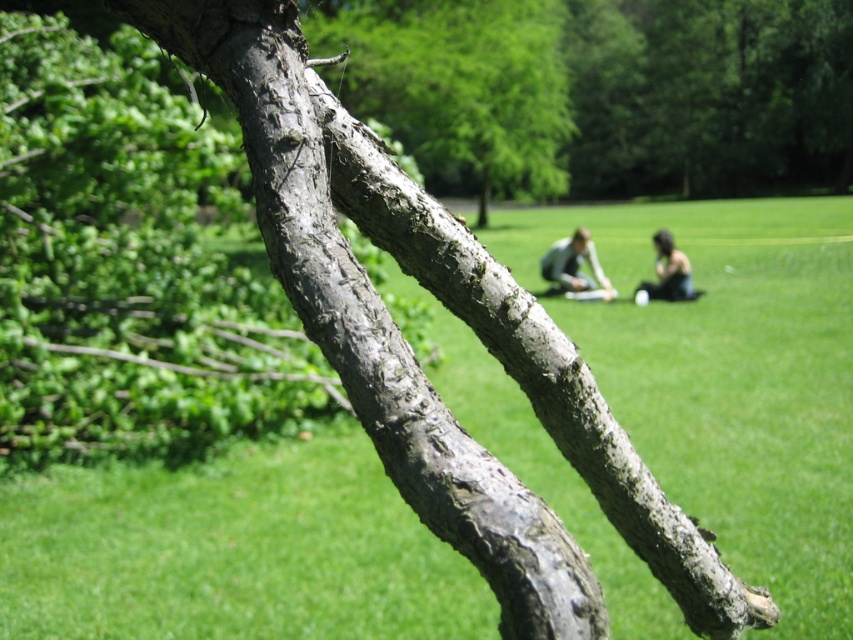
Which of these two, gray rough bark branch at upper center or light brown fabric at lower center, stands taller?

gray rough bark branch at upper center

Looking at this image, measure the distance between point (x=558, y=140) and camera.

Point (x=558, y=140) is 62.99 feet away from camera.

Does point (486, 16) lie in front of point (593, 260)?

No, (486, 16) is further to viewer.

Where is `gray rough bark branch at upper center`? gray rough bark branch at upper center is located at coordinates (457, 86).

Between gray rough bark tree trunk at center and light brown fabric at lower center, which one is positioned lower?

gray rough bark tree trunk at center is lower down.

Is gray rough bark tree trunk at center thinner than light brown fabric at lower center?

Yes, gray rough bark tree trunk at center is thinner than light brown fabric at lower center.

Which is behind, point (502, 564) or point (595, 259)?

Point (595, 259)

The image size is (853, 640). Find the location of `gray rough bark tree trunk at center`. gray rough bark tree trunk at center is located at coordinates (370, 321).

From the picture: Measure the distance from light brown fabric at lower center to dark hair person at lower right.

A distance of 28.52 inches exists between light brown fabric at lower center and dark hair person at lower right.

In the scene shown: Does light brown fabric at lower center appear on the right side of dark hair person at lower right?

Incorrect, light brown fabric at lower center is not on the right side of dark hair person at lower right.

What are the coordinates of `light brown fabric at lower center` in the screenshot? It's located at (573, 266).